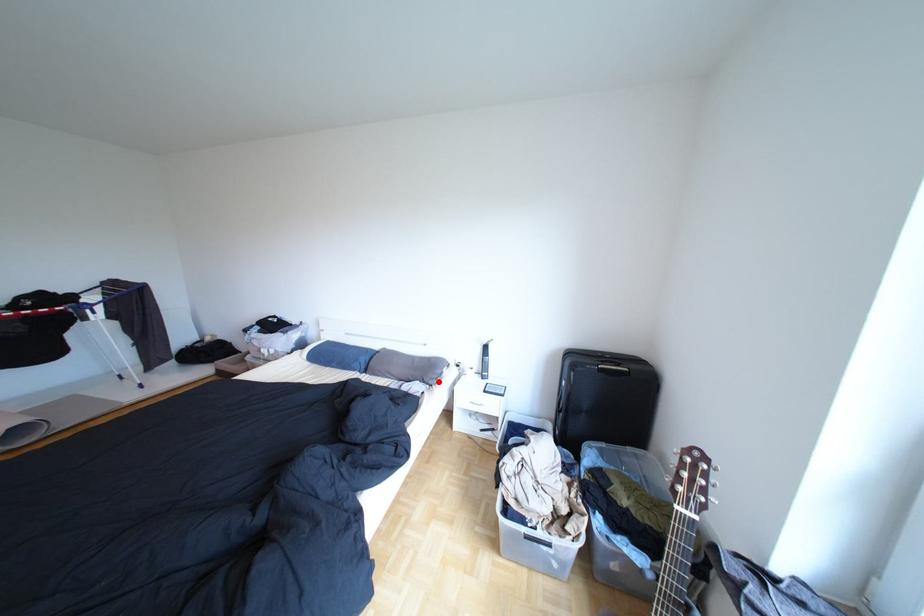
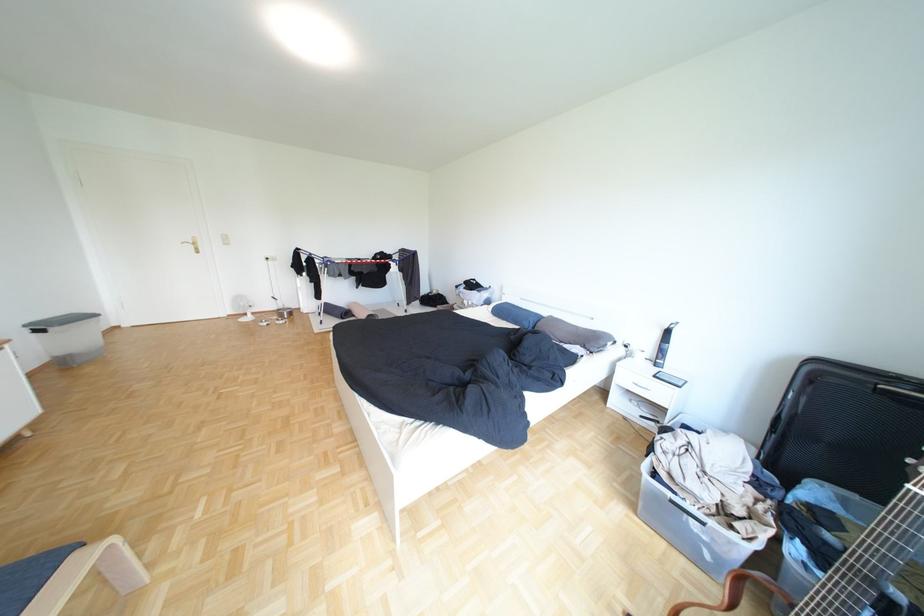
Locate, in the second image, the point that corresponds to the highlighted location in the first image.

(600, 347)